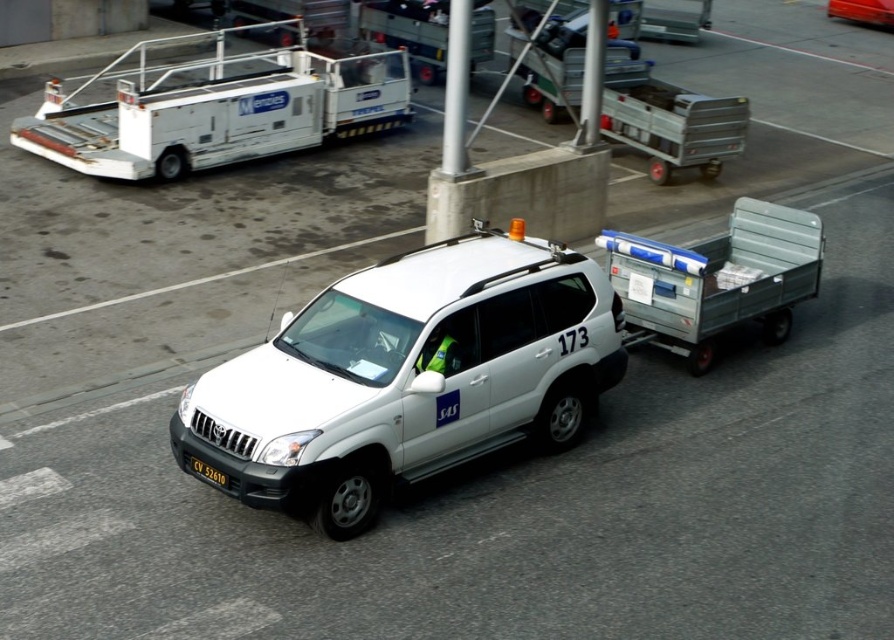
You are a maintenance worker needing to move a 10 meter long hose from the white plastic baggage cart at upper left to the gray metallic trailer at right. Can you reach the trailer with the hose without moving the cart?

The white plastic baggage cart at upper left and gray metallic trailer at right are 9.69 meters apart from each other. Since the hose is 10 meters long, it is just barely long enough to reach, so yes, you can reach the trailer with the hose without moving the cart.